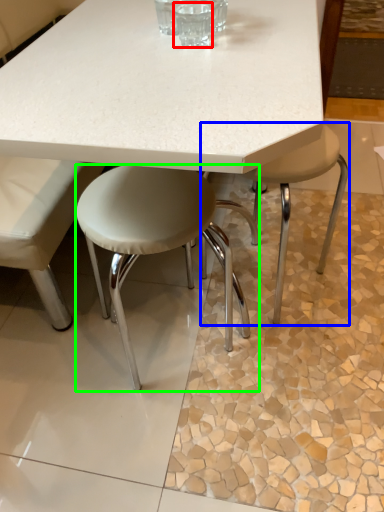
Question: Which object is the closest to the clear (highlighted by a red box)? Choose among these: stool (highlighted by a blue box) or stool (highlighted by a green box).

Choices:
 (A) stool
 (B) stool

Answer: (B)